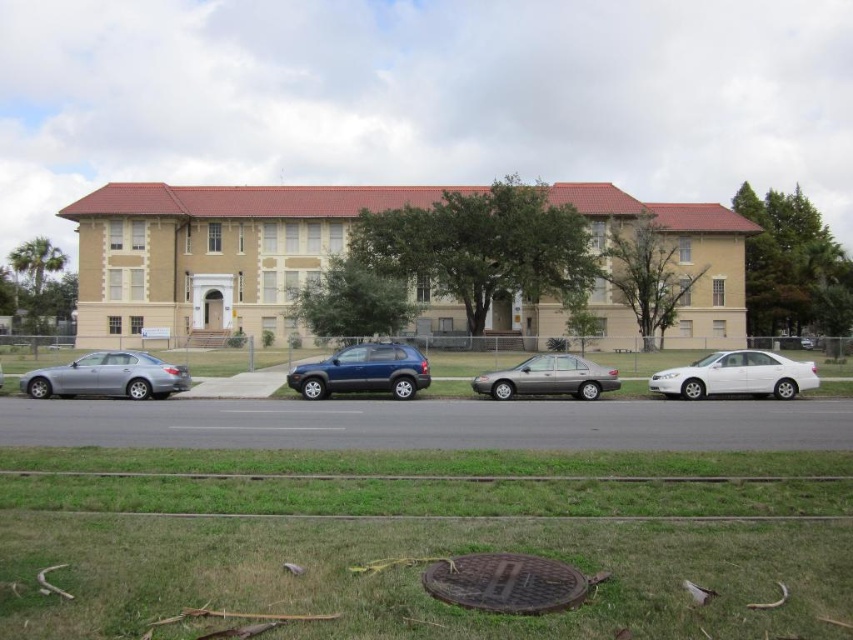
Question: Is satin silver sedan at left behind white glossy sedan at right?

Choices:
 (A) yes
 (B) no

Answer: (B)

Question: Which of these objects is positioned closest to the white glossy sedan at right?

Choices:
 (A) matte blue suv at center
 (B) brown textured manhole cover at lower center

Answer: (A)

Question: Does white glossy sedan at right have a greater width compared to satin silver sedan at center?

Choices:
 (A) no
 (B) yes

Answer: (A)

Question: Which object is positioned farthest from the matte blue suv at center?

Choices:
 (A) white glossy sedan at right
 (B) satin silver sedan at center
 (C) brown textured manhole cover at lower center
 (D) satin silver sedan at left

Answer: (C)

Question: Which of the following is the closest to the observer?

Choices:
 (A) (74, 362)
 (B) (387, 384)

Answer: (B)

Question: Is white glossy sedan at right to the left of matte blue suv at center from the viewer's perspective?

Choices:
 (A) no
 (B) yes

Answer: (A)